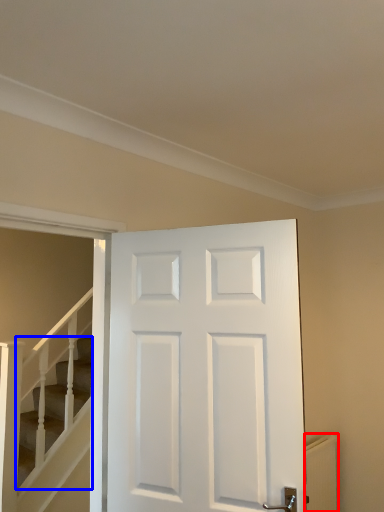
Question: Which object appears closest to the camera in this image, radiator (highlighted by a red box) or stairs (highlighted by a blue box)?

Choices:
 (A) radiator
 (B) stairs

Answer: (B)